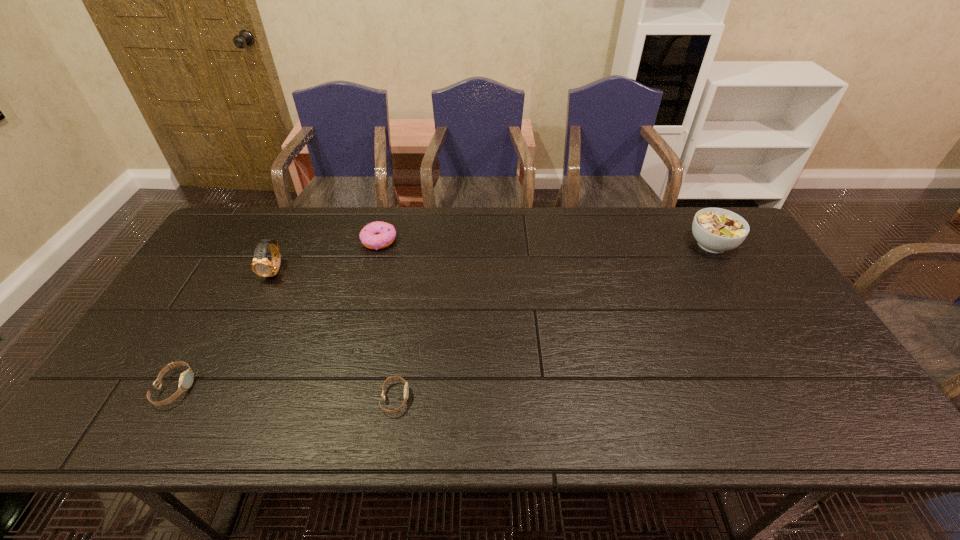
I want to click on free space at the far edge of the desktop, so click(281, 214).

In the image, there is a desktop. Where is `vacant space at the near edge`? vacant space at the near edge is located at coordinates (261, 424).

The height and width of the screenshot is (540, 960). I want to click on free space at the left edge of the desktop, so click(x=204, y=309).

Where is `vacant space at the right edge of the desktop`? This screenshot has height=540, width=960. vacant space at the right edge of the desktop is located at coordinates (x=749, y=279).

Identify the location of free space at the far left corner of the desktop. (270, 216).

Locate an element on the screen. Image resolution: width=960 pixels, height=540 pixels. free spot between the rightmost watch and the leftmost watch is located at coordinates (285, 394).

Find the location of `free spot between the shortest watch and the third object from left to right`. free spot between the shortest watch and the third object from left to right is located at coordinates (387, 320).

Find the location of a particular element. vacant space in between the doughnut and the rightmost object is located at coordinates (545, 242).

Identify the location of free space that is in between the second object from left to right and the third object from right to left. The image size is (960, 540). (327, 255).

I want to click on empty location between the third object from left to right and the second tallest watch, so click(x=277, y=314).